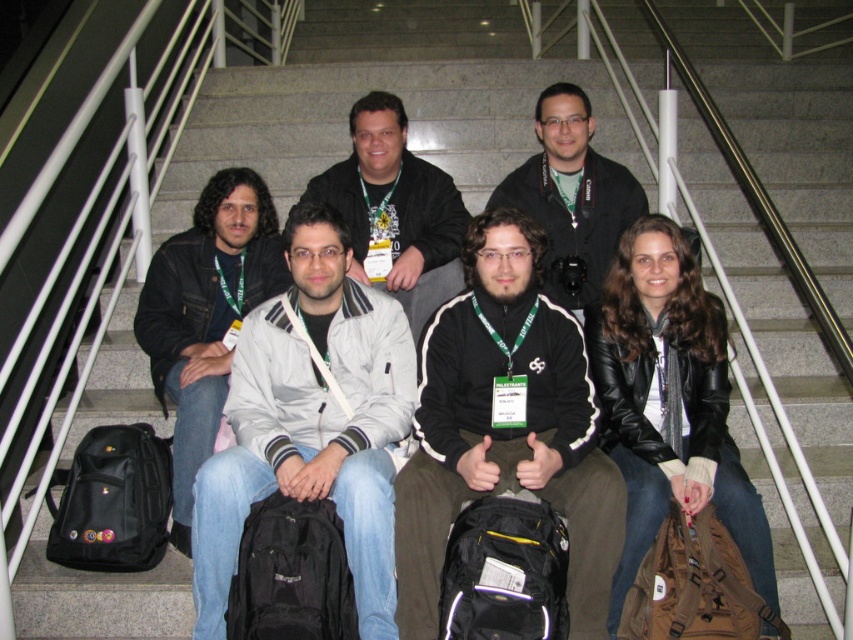
Question: Estimate the real-world distances between objects in this image. Which object is farther from the light gray fabric jacket at center?

Choices:
 (A) black leather jacket at lower right
 (B) matte black jacket at center
 (C) matte black jacket at left
 (D) black fleece jacket at center

Answer: (A)

Question: Considering the relative positions of light gray fabric jacket at center and matte black jacket at center in the image provided, where is light gray fabric jacket at center located with respect to matte black jacket at center?

Choices:
 (A) left
 (B) right

Answer: (A)

Question: Estimate the real-world distances between objects in this image. Which object is closer to the light gray fabric jacket at center?

Choices:
 (A) black leather jacket at center
 (B) matte black jacket at left

Answer: (B)

Question: Is light gray fabric jacket at center thinner than matte black jacket at center?

Choices:
 (A) no
 (B) yes

Answer: (B)

Question: Which object appears farthest from the camera in this image?

Choices:
 (A) matte black jacket at center
 (B) matte black jacket at left

Answer: (A)

Question: Does light gray fabric jacket at center have a smaller size compared to matte black jacket at center?

Choices:
 (A) yes
 (B) no

Answer: (B)